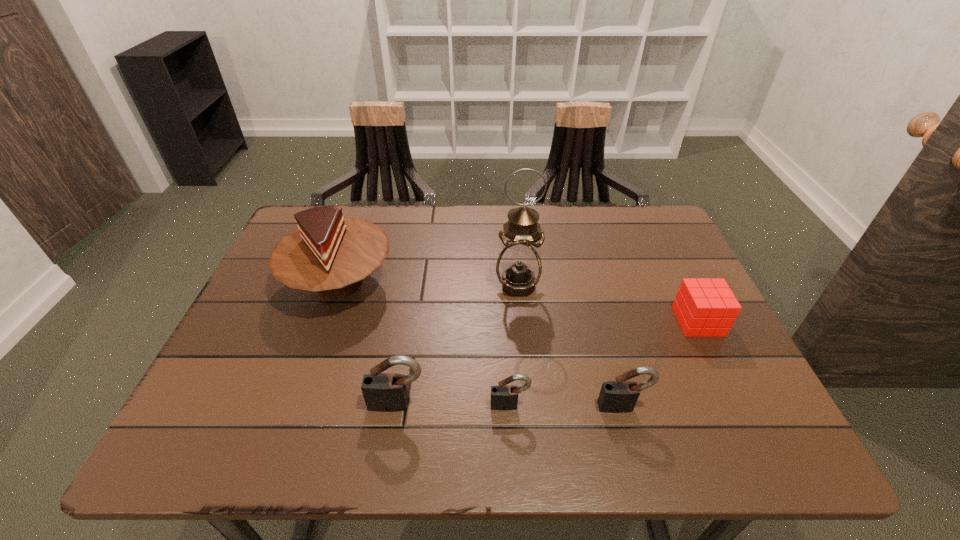
All padlocks are currently evenly spaced. To continue this pattern, where would you add another padlock on the right? Please point out a vacant spot. Please provide its 2D coordinates. Your answer should be formatted as a tuple, i.e. [(x, y)], where the tuple contains the x and y coordinates of a point satisfying the conditions above.

[(735, 408)]